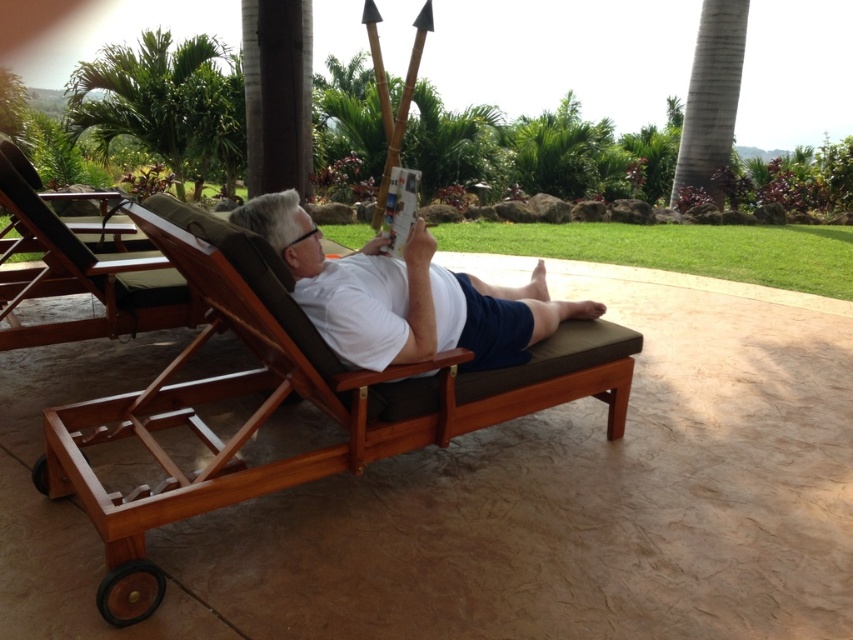
You are planning to sit on the teak wood beach chair at center while wearing your white matte shirt at center. Considering the chair and shirt sizes, will the shirt fit comfortably without being too tight or too loose? Please explain based on their sizes.

The teak wood beach chair at center is wider than the white matte shirt at center, so the shirt will fit comfortably and not be too tight. However, the shirt may appear loose compared to the chair due to the difference in width between the two.

You are standing at point (x=381, y=387) and want to move to the lounge chair. The lounge chair is 1.8 meters wide. Can you walk through the space between the lounge chair and the stone wall?

The distance between you and the lounge chair is 2.29 meters. Since the lounge chair is 1.8 meters wide, there is enough space to walk through the gap between them and the stone wall.

You are standing in the outdoor area and want to take a photo of the teak wood beach chair at center and the green leafy palm tree at upper left. Which object should you focus on first if you want both to be in sharp focus?

You should focus on the teak wood beach chair at center first because it is closer to the viewer than the green leafy palm tree at upper left. By focusing on the closer object, the background object may still be in acceptable focus depending on the camera settings.